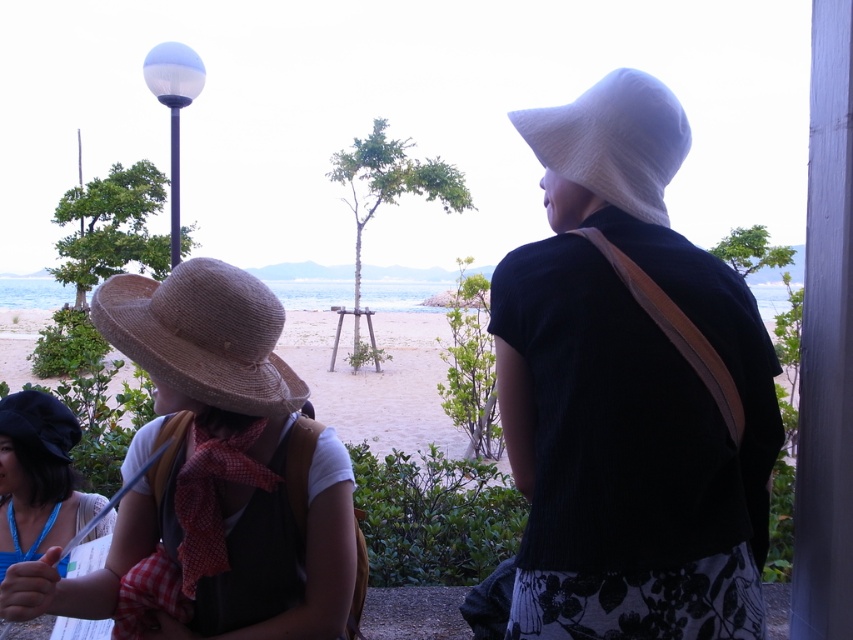
Question: Does white straw hat at upper right have a greater width compared to matte black hat at lower left?

Choices:
 (A) yes
 (B) no

Answer: (B)

Question: Is white straw hat at upper right thinner than matte blue hat at lower left?

Choices:
 (A) yes
 (B) no

Answer: (A)

Question: Which object is positioned closest to the matte blue hat at lower left?

Choices:
 (A) brown straw hat at center
 (B) matte black hat at lower left

Answer: (B)

Question: Which of these objects is positioned closest to the white straw hat at upper right?

Choices:
 (A) matte blue hat at lower left
 (B) matte black hat at lower left
 (C) strawmaterial/texturehat at left

Answer: (C)

Question: Does white straw hat at upper right appear over matte blue hat at lower left?

Choices:
 (A) yes
 (B) no

Answer: (A)

Question: Which object is closer to the camera taking this photo?

Choices:
 (A) white straw hat at upper right
 (B) white woven hat at upper right

Answer: (B)